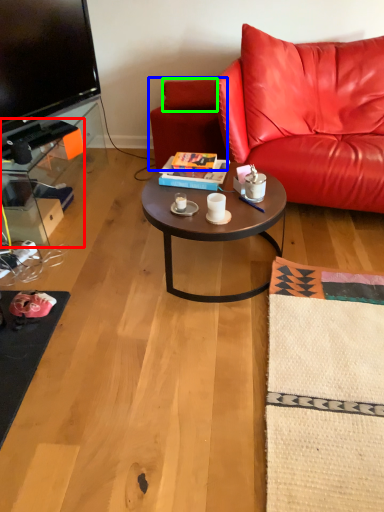
Question: Which is farther away from desk (highlighted by a red box)? swivel chair (highlighted by a blue box) or pillow (highlighted by a green box)?

Choices:
 (A) swivel chair
 (B) pillow

Answer: (B)